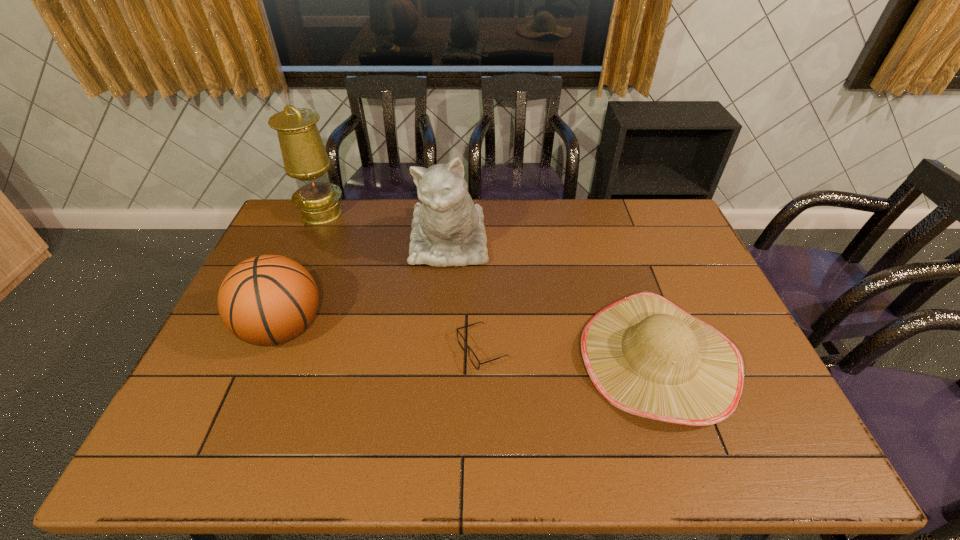
Find the location of a particular element. This screenshot has height=540, width=960. object that is at the near right corner is located at coordinates (645, 355).

At what (x,y) coordinates should I click in order to perform the action: click on vacant space at the far edge of the desktop. Please return your answer as a coordinate pair (x, y). Looking at the image, I should click on (392, 208).

Locate an element on the screen. vacant space at the near edge is located at coordinates (365, 455).

The width and height of the screenshot is (960, 540). Find the location of `free region at the far right corner`. free region at the far right corner is located at coordinates (664, 205).

In order to click on empty space that is in between the shortest object and the sunhat in this screenshot , I will do point(570,354).

Locate an element on the screen. free point between the oil lamp and the sunhat is located at coordinates (490, 286).

What are the coordinates of `free spot between the basketball and the second shortest object` in the screenshot? It's located at (470, 344).

The width and height of the screenshot is (960, 540). Find the location of `free space between the cat and the oil lamp`. free space between the cat and the oil lamp is located at coordinates (385, 227).

Find the location of `vacant area that lies between the rightmost object and the cat`. vacant area that lies between the rightmost object and the cat is located at coordinates (553, 300).

Where is `vacant area that lies between the oil lamp and the cat`? The width and height of the screenshot is (960, 540). vacant area that lies between the oil lamp and the cat is located at coordinates (385, 227).